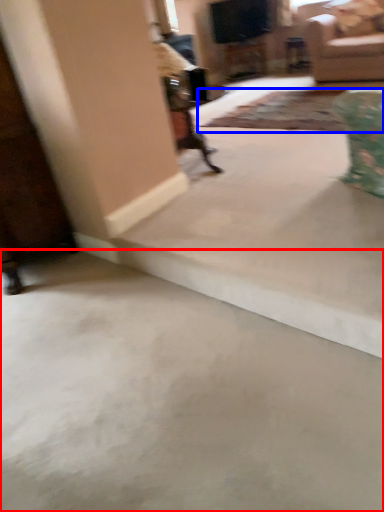
Question: Among these objects, which one is farthest to the camera, concrete (highlighted by a red box) or mat (highlighted by a blue box)?

Choices:
 (A) concrete
 (B) mat

Answer: (B)